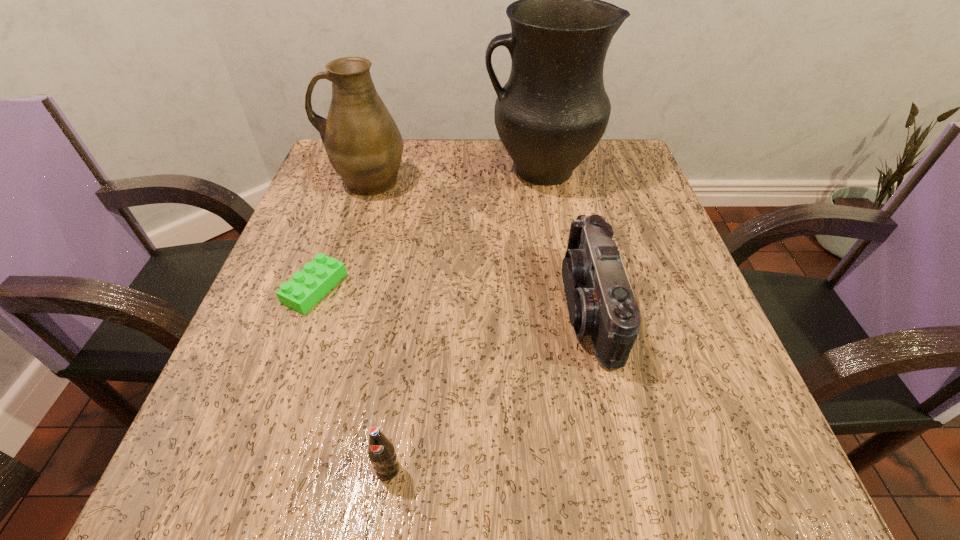
I want to click on vacant region between the right pitcher and the left pitcher, so click(454, 176).

Where is `free space between the third object from right to left and the camcorder`? This screenshot has height=540, width=960. free space between the third object from right to left and the camcorder is located at coordinates (489, 388).

Where is `free space between the Lego and the camcorder`? This screenshot has width=960, height=540. free space between the Lego and the camcorder is located at coordinates (452, 298).

The width and height of the screenshot is (960, 540). I want to click on free point between the nearest object and the Lego, so point(351,379).

The image size is (960, 540). Identify the location of unoccupied area between the tallest object and the shortest object. (427, 229).

Locate an element on the screen. The image size is (960, 540). unoccupied area between the left pitcher and the camcorder is located at coordinates (478, 245).

Identify the location of unoccupied position between the shorter pitcher and the Lego. This screenshot has height=540, width=960. (341, 235).

Locate an element on the screen. The image size is (960, 540). object that is the third nearest to the nearest object is located at coordinates (363, 143).

Select which object appears as the second closest to the camcorder. Please provide its 2D coordinates. Your answer should be formatted as a tuple, i.e. [(x, y)], where the tuple contains the x and y coordinates of a point satisfying the conditions above.

[(381, 452)]

Locate an element on the screen. The width and height of the screenshot is (960, 540). free space that satisfies the following two spatial constraints: 1. on the handle side of the right pitcher; 2. on the front label of the nearest object is located at coordinates (591, 469).